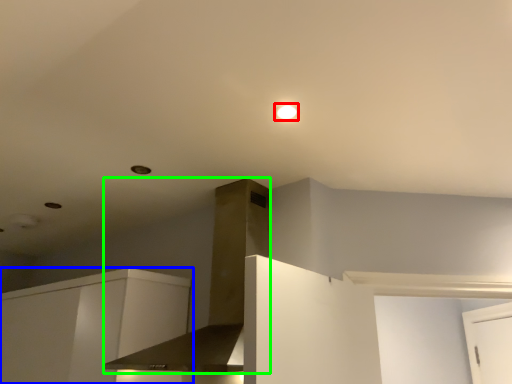
Question: Considering the real-world distances, which object is farthest from lighting (highlighted by a red box)? cabinetry (highlighted by a blue box) or vent (highlighted by a green box)?

Choices:
 (A) cabinetry
 (B) vent

Answer: (A)